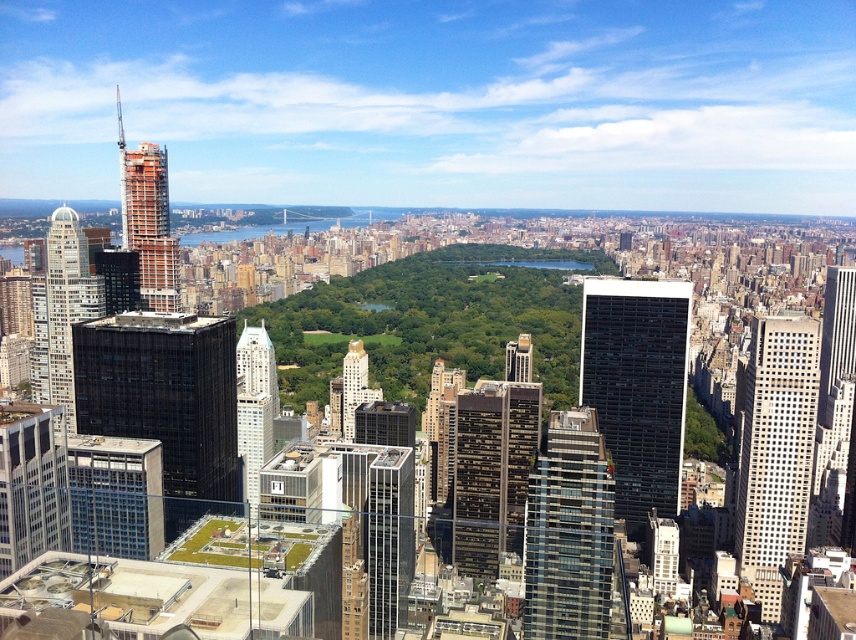
Question: Can you confirm if black glass building at center-left is smaller than dark brown glass building at center?

Choices:
 (A) yes
 (B) no

Answer: (B)

Question: Which point appears farthest from the camera in this image?

Choices:
 (A) pos(164,349)
 (B) pos(55,330)
 (C) pos(446,452)
 (D) pos(812,420)

Answer: (D)

Question: Which of the following is the farthest from the observer?

Choices:
 (A) click(x=46, y=244)
 (B) click(x=358, y=360)
 (C) click(x=776, y=416)

Answer: (C)

Question: Observing the image, what is the correct spatial positioning of black glass building at center in reference to matte glass skyscraper at left?

Choices:
 (A) right
 (B) left

Answer: (A)

Question: Which object appears closest to the camera in this image?

Choices:
 (A) transparent glass skyscraper at center
 (B) matte glass skyscraper at lower left
 (C) black glass building at center-left
 (D) black glass building at center

Answer: (D)

Question: Where is dark glass skyscraper at center located in relation to matte glass skyscraper at lower left in the image?

Choices:
 (A) below
 (B) above

Answer: (B)